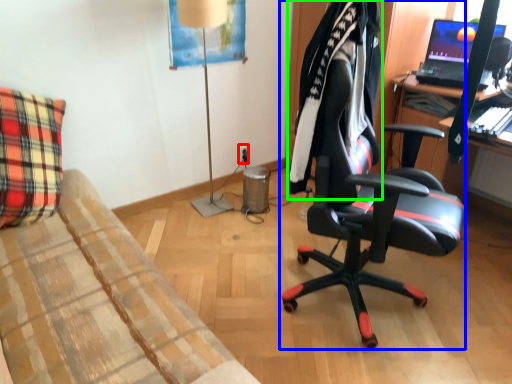
Question: Which object is the farthest from power outlet (highlighted by a red box)? Choose among these: chair (highlighted by a blue box) or clothing (highlighted by a green box).

Choices:
 (A) chair
 (B) clothing

Answer: (B)